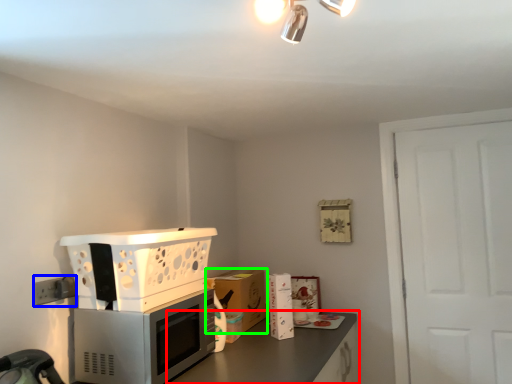
Question: Which object is positioned farthest from countertop (highlighted by a red box)? Select from electric outlet (highlighted by a blue box) and cabinetry (highlighted by a green box).

Choices:
 (A) electric outlet
 (B) cabinetry

Answer: (A)